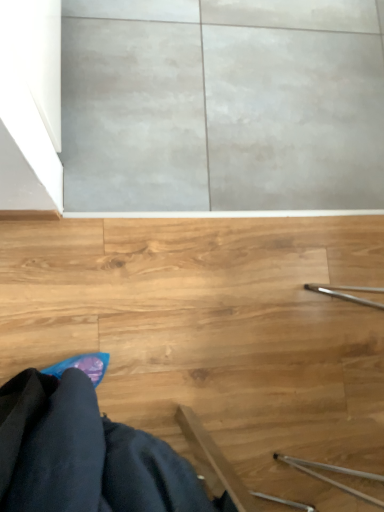
What is the approximate height of black fabric robe at lower left?

black fabric robe at lower left is 28.63 inches in height.

Where is `black fabric robe at lower left`? The image size is (384, 512). black fabric robe at lower left is located at coordinates (85, 455).

The width and height of the screenshot is (384, 512). Describe the element at coordinates (85, 455) in the screenshot. I see `black fabric robe at lower left` at that location.

This screenshot has height=512, width=384. What do you see at coordinates (213, 333) in the screenshot?
I see `wooden stairs at lower right` at bounding box center [213, 333].

Measure the distance between wooden stairs at lower right and camera.

A distance of 1.09 meters exists between wooden stairs at lower right and camera.

Locate an element on the screen. wooden stairs at lower right is located at coordinates (x=213, y=333).

Find the location of a particular element. The image size is (384, 512). black fabric robe at lower left is located at coordinates (85, 455).

Considering the relative positions of black fabric robe at lower left and wooden stairs at lower right in the image provided, is black fabric robe at lower left to the right of wooden stairs at lower right from the viewer's perspective?

In fact, black fabric robe at lower left is to the left of wooden stairs at lower right.

Does black fabric robe at lower left lie behind wooden stairs at lower right?

That is False.

Between point (34, 396) and point (348, 259), which one is positioned in front?

Positioned in front is point (34, 396).

From the image's perspective, does black fabric robe at lower left appear higher than wooden stairs at lower right?

Incorrect, from the image's perspective, black fabric robe at lower left is lower than wooden stairs at lower right.

From a real-world perspective, is black fabric robe at lower left physically located above or below wooden stairs at lower right?

Clearly, from a real-world perspective, black fabric robe at lower left is above wooden stairs at lower right.

Considering the sizes of black fabric robe at lower left and wooden stairs at lower right in the image, is black fabric robe at lower left wider or thinner than wooden stairs at lower right?

Answer: Clearly, black fabric robe at lower left has less width compared to wooden stairs at lower right.

Between black fabric robe at lower left and wooden stairs at lower right, which one has more height?

black fabric robe at lower left is taller.

Consider the image. Considering the sizes of black fabric robe at lower left and wooden stairs at lower right in the image, is black fabric robe at lower left bigger or smaller than wooden stairs at lower right?

Considering their sizes, black fabric robe at lower left takes up less space than wooden stairs at lower right.

Could wooden stairs at lower right be considered to be inside black fabric robe at lower left?

No, wooden stairs at lower right is not a part of black fabric robe at lower left.

Are black fabric robe at lower left and wooden stairs at lower right making contact?

No, black fabric robe at lower left is not beside wooden stairs at lower right.

Could you tell me if black fabric robe at lower left is facing wooden stairs at lower right?

No, black fabric robe at lower left is not oriented towards wooden stairs at lower right.

How many degrees apart are the facing directions of black fabric robe at lower left and wooden stairs at lower right?

They differ by 66.8 degrees in their facing directions.

The image size is (384, 512). In order to click on stairs below the black fabric robe at lower left (from a real-world perspective) in this screenshot , I will do `click(213, 333)`.

Does wooden stairs at lower right appear on the left side of black fabric robe at lower left?

No, wooden stairs at lower right is not to the left of black fabric robe at lower left.

Which object is more forward, wooden stairs at lower right or black fabric robe at lower left?

black fabric robe at lower left.

Is point (192, 219) positioned behind point (43, 452)?

Yes, it is behind point (43, 452).

From the image's perspective, which object appears higher, wooden stairs at lower right or black fabric robe at lower left?

wooden stairs at lower right, from the image's perspective.

From a real-world perspective, is wooden stairs at lower right under black fabric robe at lower left?

Yes, from a real-world perspective, wooden stairs at lower right is beneath black fabric robe at lower left.

Is wooden stairs at lower right wider or thinner than black fabric robe at lower left?

Considering their sizes, wooden stairs at lower right looks broader than black fabric robe at lower left.

Consider the image. Is wooden stairs at lower right shorter than black fabric robe at lower left?

Yes, wooden stairs at lower right is shorter than black fabric robe at lower left.

Between wooden stairs at lower right and black fabric robe at lower left, which one has smaller size?

With smaller size is black fabric robe at lower left.

In the scene shown: Does wooden stairs at lower right contain black fabric robe at lower left?

No, black fabric robe at lower left is located outside of wooden stairs at lower right.

Is wooden stairs at lower right next to black fabric robe at lower left and touching it?

They are not placed beside each other.

Is wooden stairs at lower right looking in the opposite direction of black fabric robe at lower left?

No, black fabric robe at lower left is not at the back of wooden stairs at lower right.

The height and width of the screenshot is (512, 384). What are the coordinates of `stairs that is behind the black fabric robe at lower left` in the screenshot? It's located at (213, 333).

Where is `robe below the wooden stairs at lower right (from the image's perspective)`? The height and width of the screenshot is (512, 384). robe below the wooden stairs at lower right (from the image's perspective) is located at coordinates (85, 455).

Identify the location of stairs on the right of the black fabric robe at lower left. (213, 333).